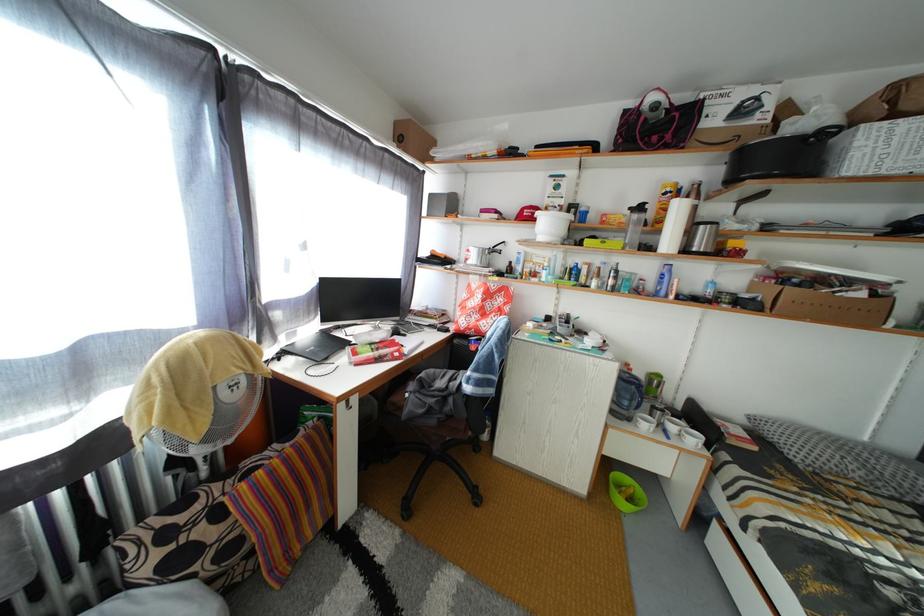
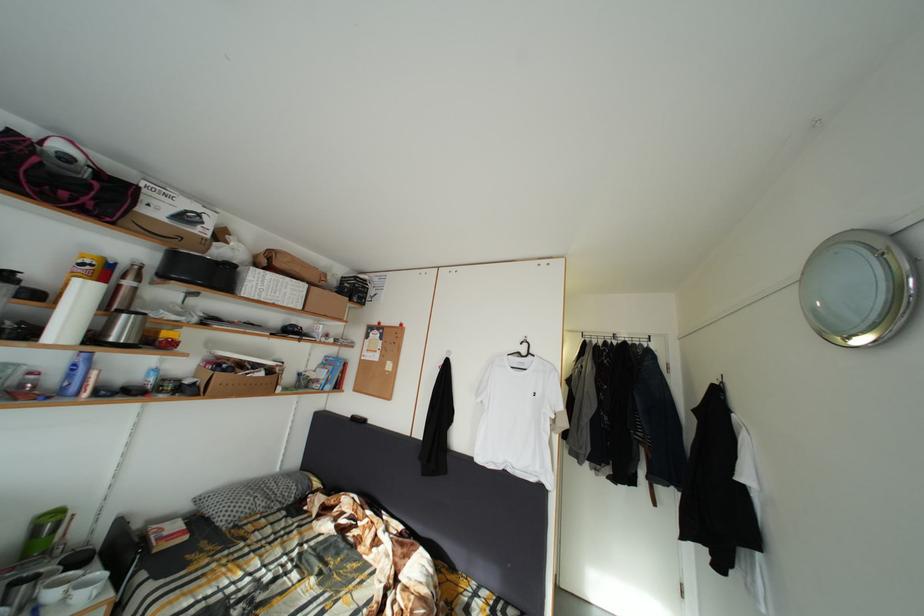
In the second image, find the point that corresponds to (703,256) in the first image.

(120, 345)